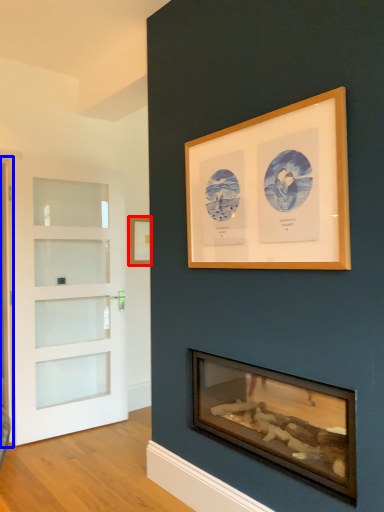
Question: Which object appears farthest to the camera in this image, picture frame (highlighted by a red box) or screen door (highlighted by a blue box)?

Choices:
 (A) picture frame
 (B) screen door

Answer: (A)